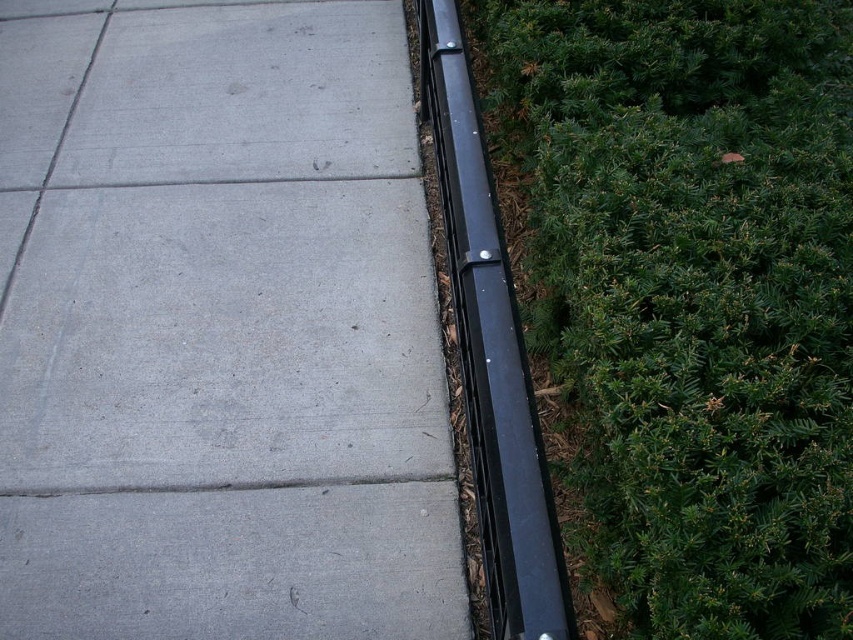
Question: Considering the real-world distances, which object is farthest from the gray concrete pavement at center?

Choices:
 (A) black metal curb at right
 (B) green leafy hedge at right

Answer: (B)

Question: From the image, what is the correct spatial relationship of green leafy hedge at right in relation to black metal curb at right?

Choices:
 (A) below
 (B) above

Answer: (B)

Question: Does gray concrete pavement at center have a smaller size compared to black metal curb at right?

Choices:
 (A) no
 (B) yes

Answer: (A)

Question: Which point is farther to the camera?

Choices:
 (A) black metal curb at right
 (B) green leafy hedge at right

Answer: (B)

Question: Which object is closer to the camera taking this photo?

Choices:
 (A) gray concrete pavement at center
 (B) green leafy hedge at right

Answer: (B)

Question: Is green leafy hedge at right to the left of black metal curb at right from the viewer's perspective?

Choices:
 (A) yes
 (B) no

Answer: (B)